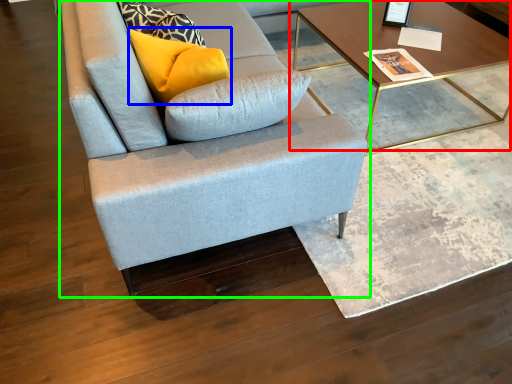
Question: Based on their relative distances, which object is nearer to coffee table (highlighted by a red box)? Choose from pillow (highlighted by a blue box) and studio couch (highlighted by a green box).

Choices:
 (A) pillow
 (B) studio couch

Answer: (B)